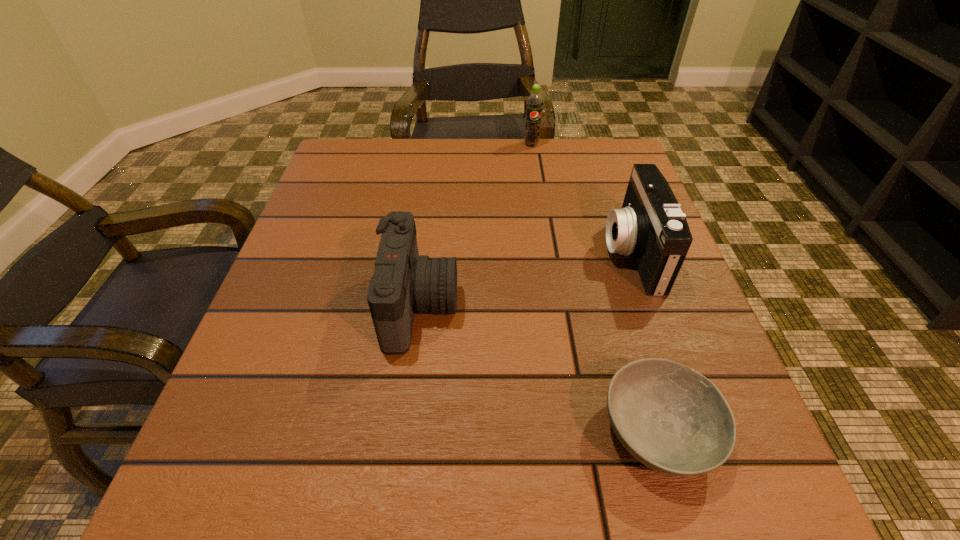
I want to click on vacant space that satisfies the following two spatial constraints: 1. on the front label of the farthest object; 2. at the lens of the leftmost object, so click(x=557, y=306).